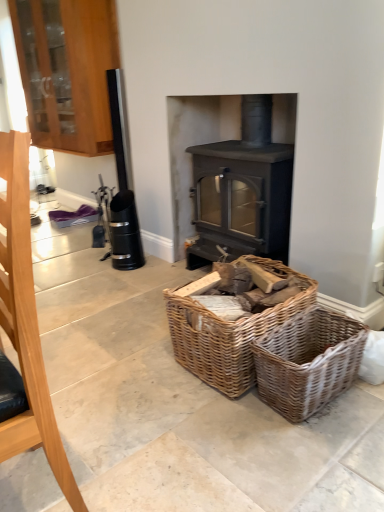
Locate an element on the screen. This screenshot has height=512, width=384. free space in front of woven brown basket at lower center is located at coordinates (320, 451).